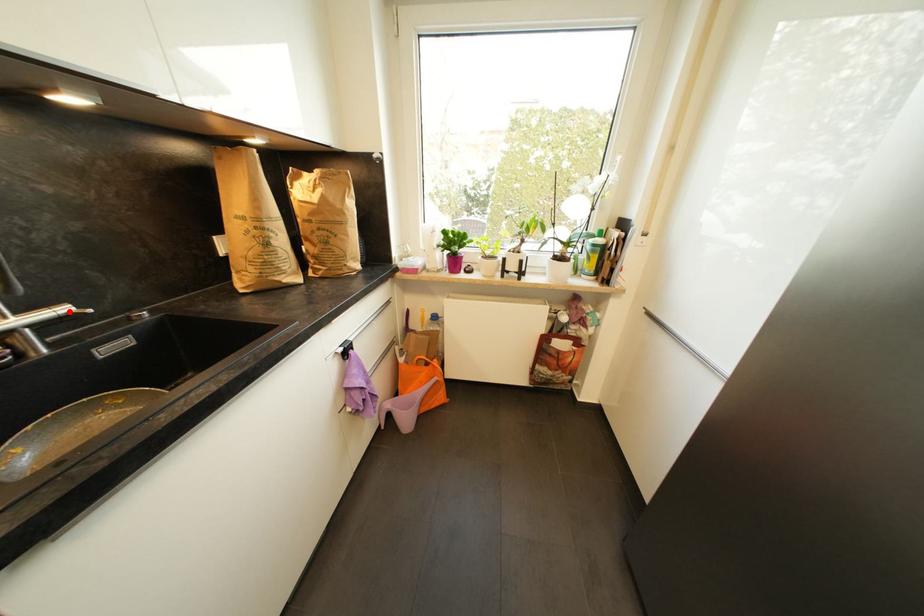
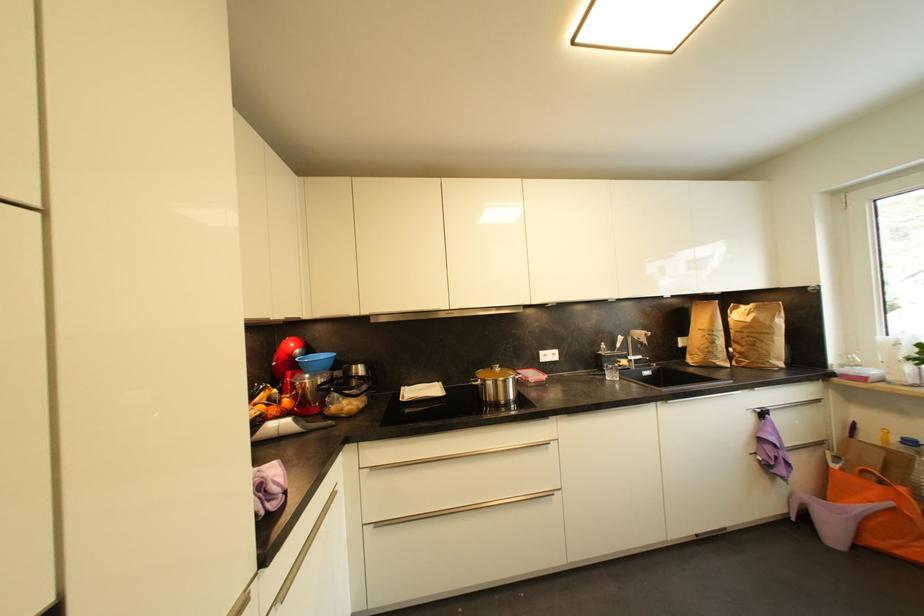
Where in the second image is the point corresponding to the highlighted location from the first image?

(645, 359)